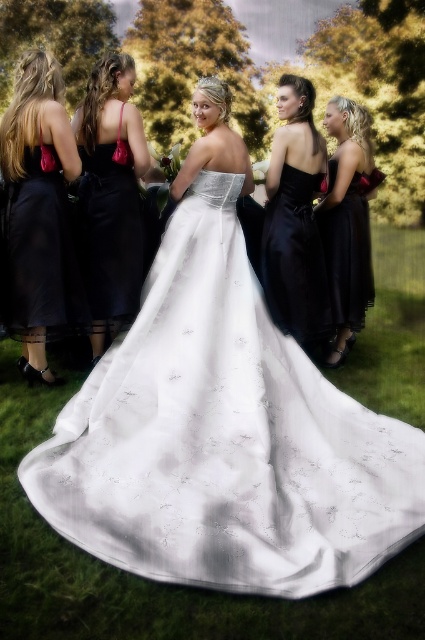
Question: Among these points, which one is farthest from the camera?

Choices:
 (A) (337, 193)
 (B) (87, 195)
 (C) (56, 241)

Answer: (A)

Question: Does white satin dress at center have a greater width compared to matte black dress at right?

Choices:
 (A) no
 (B) yes

Answer: (B)

Question: Can you confirm if white satin dress at center is wider than matte black dress at left?

Choices:
 (A) yes
 (B) no

Answer: (A)

Question: Is white satin dress at center thinner than matte black dress at left?

Choices:
 (A) yes
 (B) no

Answer: (B)

Question: Which object is positioned closest to the matte black dress at right?

Choices:
 (A) matte black dress at center
 (B) white satin dress at center
 (C) satin white gown at center

Answer: (A)

Question: Which point is farther from the camera taking this photo?

Choices:
 (A) (308, 298)
 (B) (28, 285)
 (C) (28, 264)
 (D) (141, 234)

Answer: (A)